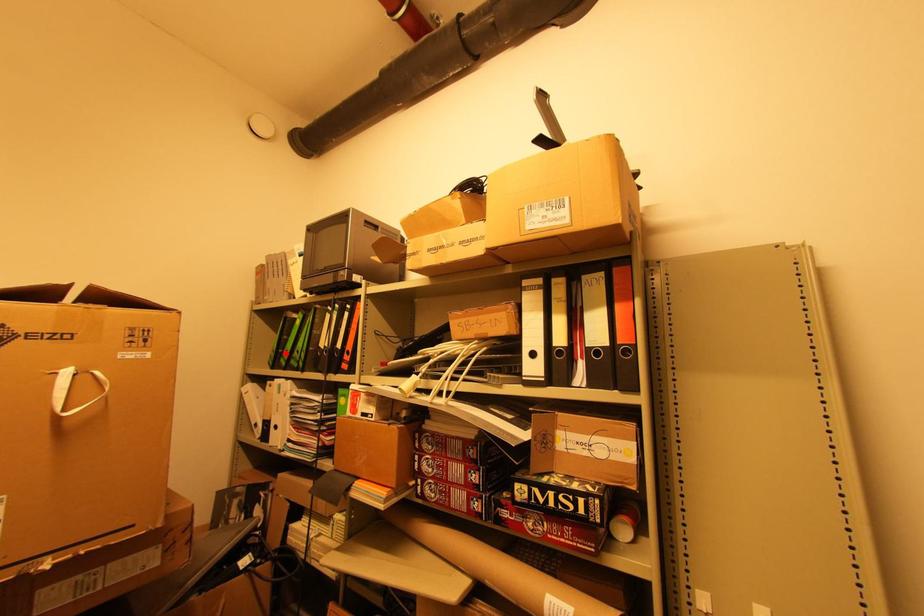
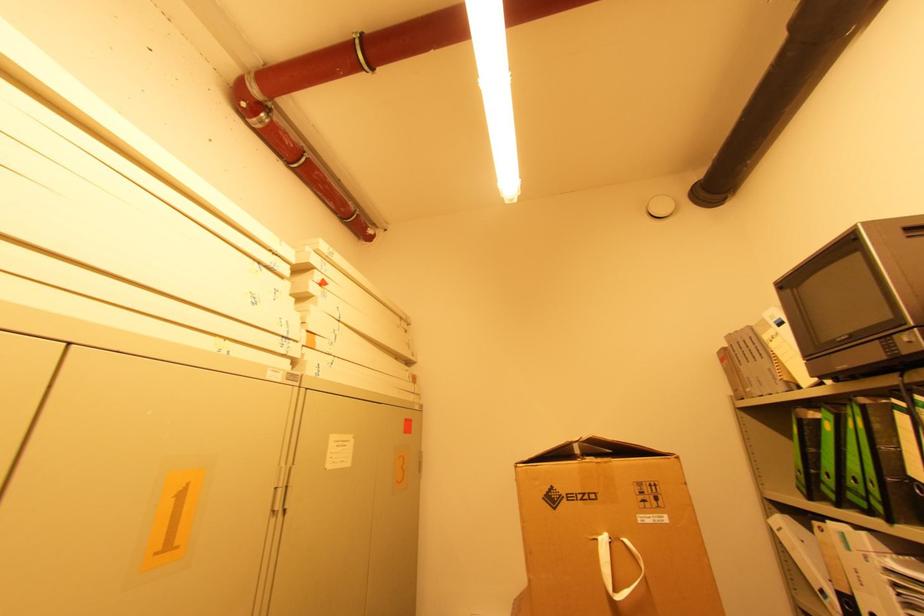
Question: I am providing you with two images of the same scene from different viewpoints. A red point is marked on the first image. Is the red point's position out of view in image 2?

Choices:
 (A) Yes
 (B) No

Answer: (B)